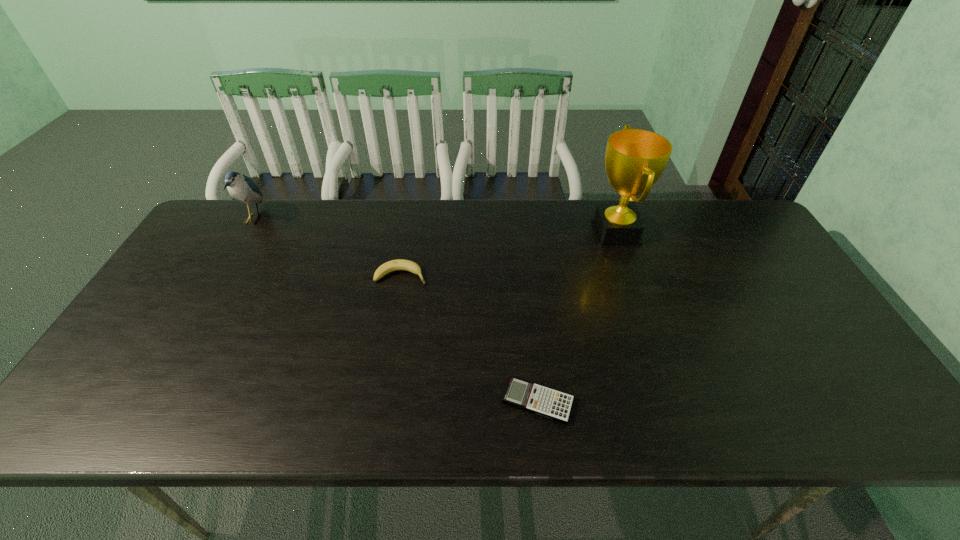
Locate an element on the screen. The width and height of the screenshot is (960, 540). free spot located 0.400m on the front-facing side of the award is located at coordinates (464, 232).

Locate an element on the screen. The image size is (960, 540). blank space located 0.350m at the tip of the bird's beak is located at coordinates (371, 219).

Image resolution: width=960 pixels, height=540 pixels. Find the location of `free space located 0.130m at the stem of the third tallest object`. free space located 0.130m at the stem of the third tallest object is located at coordinates (473, 275).

Identify the location of vacant space positioned on the left of the shortest object. pyautogui.click(x=335, y=401).

At what (x,y) coordinates should I click in order to perform the action: click on award at the far edge. Please return your answer as a coordinate pair (x, y). The width and height of the screenshot is (960, 540). Looking at the image, I should click on pyautogui.click(x=635, y=159).

Where is `bird at the far edge`? bird at the far edge is located at coordinates (242, 188).

Where is `object that is positioned at the near edge`? The height and width of the screenshot is (540, 960). object that is positioned at the near edge is located at coordinates (543, 401).

At what (x,y) coordinates should I click in order to perform the action: click on object located at the left edge. Please return your answer as a coordinate pair (x, y). The image size is (960, 540). Looking at the image, I should click on (242, 188).

In order to click on object that is at the far left corner in this screenshot , I will do `click(242, 188)`.

Where is `vacant space at the far edge of the desktop`? The image size is (960, 540). vacant space at the far edge of the desktop is located at coordinates (453, 230).